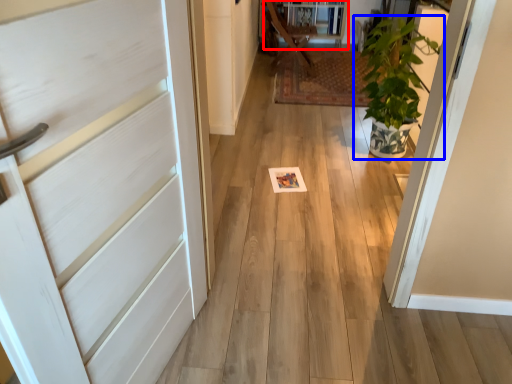
Question: Which point is closer to the camera, bookshelf (highlighted by a red box) or houseplant (highlighted by a blue box)?

Choices:
 (A) bookshelf
 (B) houseplant

Answer: (B)